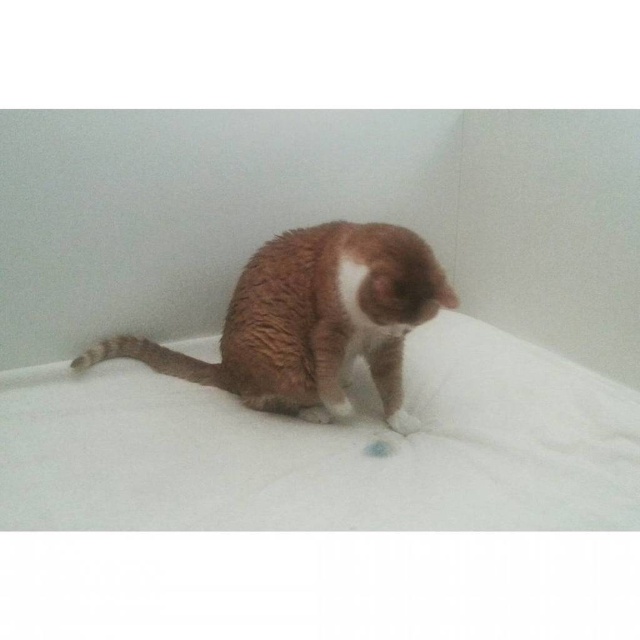
Does point (291, 392) come farther from viewer compared to point (396, 410)?

No, it is in front of (396, 410).

Measure the distance between point (339, 230) and camera.

A distance of 1.40 meters exists between point (339, 230) and camera.

What do you see at coordinates (310, 320) in the screenshot?
I see `brown fur cat at center` at bounding box center [310, 320].

At what (x,y) coordinates should I click in order to perform the action: click on brown fur cat at center. Please return your answer as a coordinate pair (x, y). Looking at the image, I should click on (310, 320).